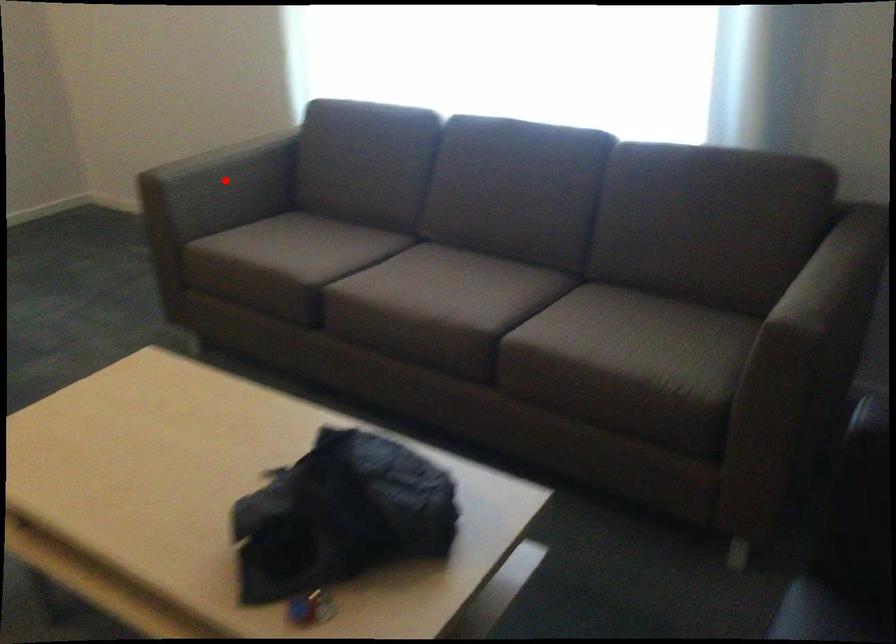
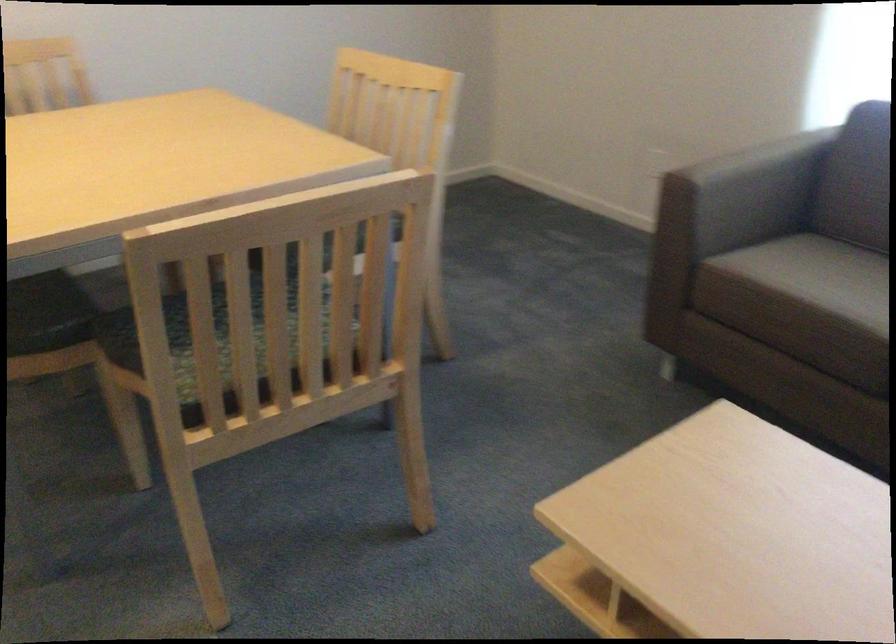
Locate, in the second image, the point that corresponds to the highlighted location in the first image.

(746, 192)